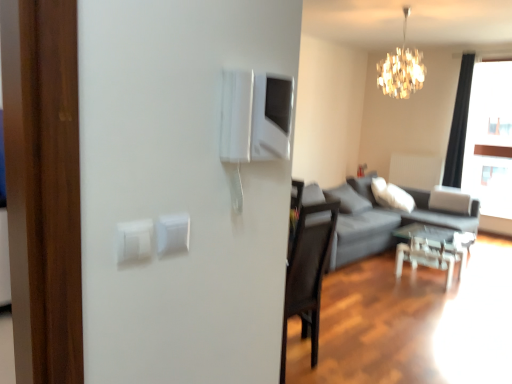
Question: From their relative heights in the image, would you say white plastic light switch at upper left, acting as the second light switch starting from the back, is taller or shorter than dark gray fabric couch at right?

Choices:
 (A) tall
 (B) short

Answer: (B)

Question: Considering the positions of point (137, 253) and point (352, 208), is point (137, 253) closer or farther from the camera than point (352, 208)?

Choices:
 (A) farther
 (B) closer

Answer: (B)

Question: Which of these objects is positioned closest to the dark gray fabric couch at right?

Choices:
 (A) shiny crystal chandelier at upper center
 (B) white plastic light switch at center, which appears as the first light switch when viewed from the back
 (C) transparent glass table at lower right
 (D) black fabric curtain at upper right
 (E) white plastic light switch at upper left, which ranks as the first light switch in left-to-right order

Answer: (C)

Question: Which of these objects is positioned farthest from the shiny crystal chandelier at upper center?

Choices:
 (A) white plastic light switch at center, marked as the 2th light switch in a front-to-back arrangement
 (B) white plastic light switch at upper left, which ranks as the first light switch in left-to-right order
 (C) dark gray fabric couch at right
 (D) black fabric curtain at upper right
 (E) transparent glass table at lower right

Answer: (B)